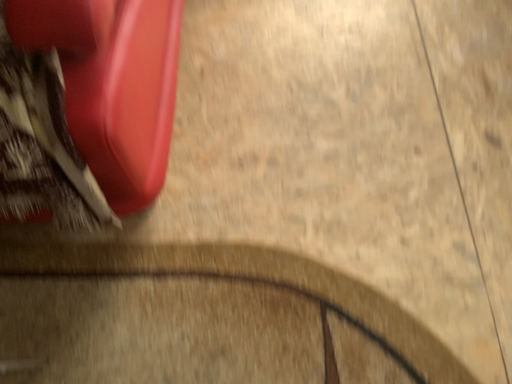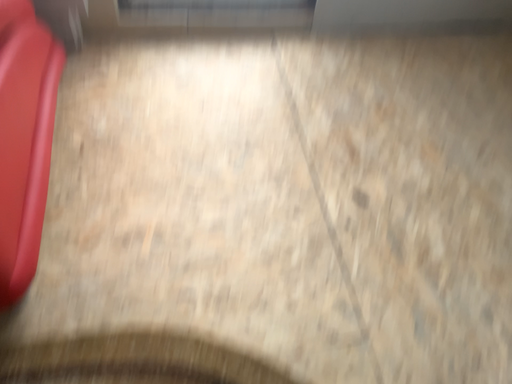
Question: Which way did the camera rotate in the video?

Choices:
 (A) rotated downward
 (B) rotated upward

Answer: (B)